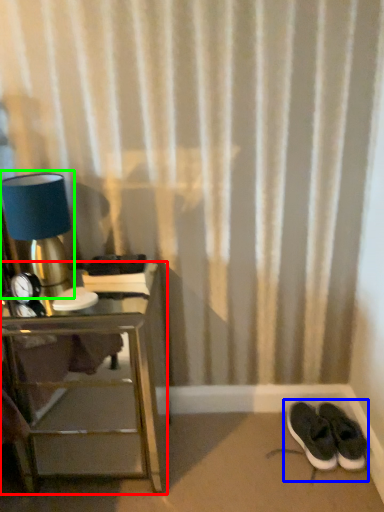
Question: Which object is positioned farthest from nightstand (highlighted by a red box)? Select from footwear (highlighted by a blue box) and table lamp (highlighted by a green box).

Choices:
 (A) footwear
 (B) table lamp

Answer: (A)